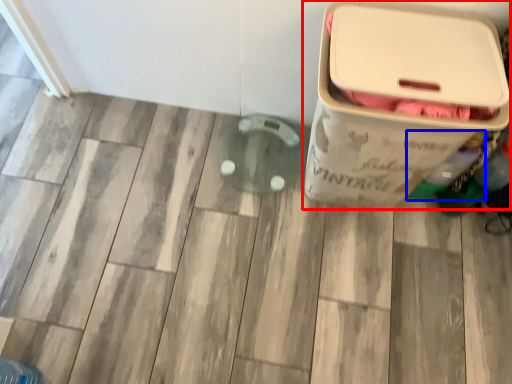
Question: Which object is further to the camera taking this photo, waste container (highlighted by a red box) or bottle (highlighted by a blue box)?

Choices:
 (A) waste container
 (B) bottle

Answer: (B)